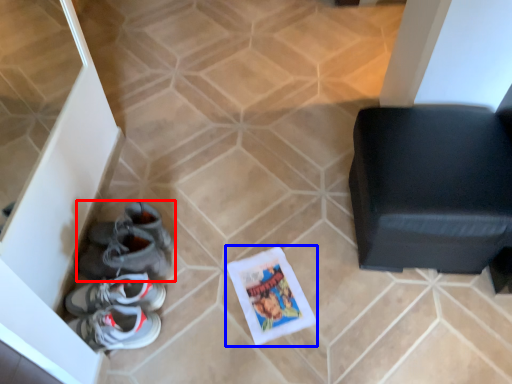
Question: Which object is closer to the camera taking this photo, footwear (highlighted by a red box) or comic book (highlighted by a blue box)?

Choices:
 (A) footwear
 (B) comic book

Answer: (A)